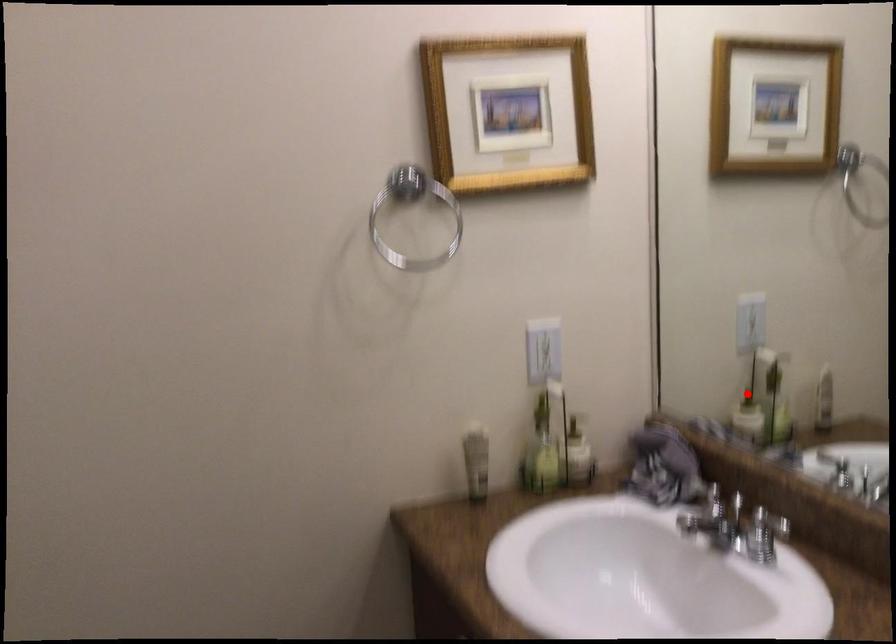
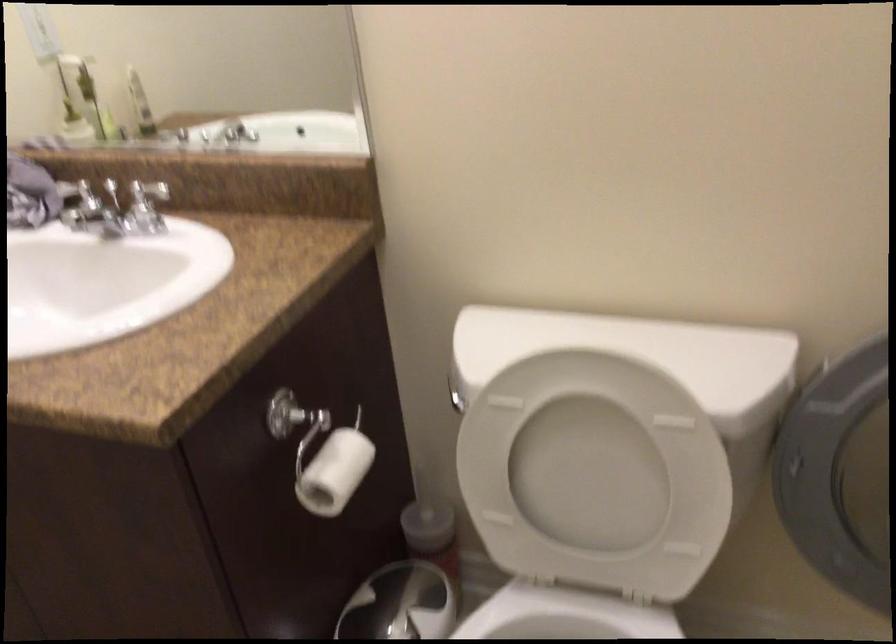
Find the pixel in the second image that matches the highlighted location in the first image.

(70, 111)